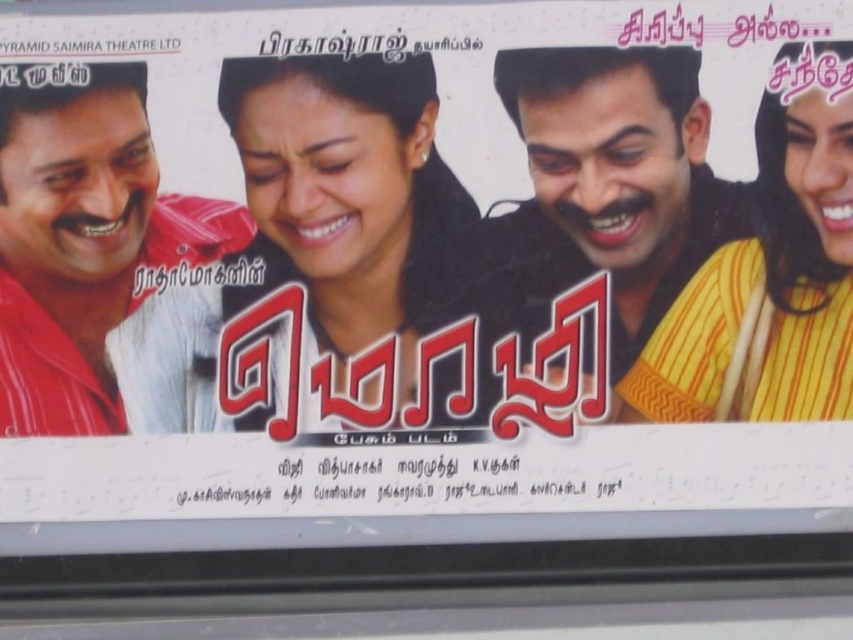
Does matte red shirt at left come behind yellow striped sari at right?

Yes, matte red shirt at left is further from the viewer.

Describe the element at coordinates (83, 237) in the screenshot. The height and width of the screenshot is (640, 853). I see `matte red shirt at left` at that location.

I want to click on matte red shirt at left, so click(x=83, y=237).

Between yellow striped shirt at right and matte red shirt at left, which one appears on the left side from the viewer's perspective?

From the viewer's perspective, matte red shirt at left appears more on the left side.

Does point (641, 124) lie behind point (149, 228)?

No, (641, 124) is in front of (149, 228).

Who is more forward, (x=740, y=193) or (x=45, y=333)?

Point (x=45, y=333) is more forward.

This screenshot has height=640, width=853. In order to click on yellow striped shirt at right in this screenshot , I will do `click(598, 195)`.

Describe the element at coordinates (598, 195) in the screenshot. The width and height of the screenshot is (853, 640). I see `yellow striped shirt at right` at that location.

Locate an element on the screen. The image size is (853, 640). yellow striped shirt at right is located at coordinates (598, 195).

Between point (521, 310) and point (799, 280), which one is positioned in front?

Point (799, 280)

Locate an element on the screen. yellow striped shirt at right is located at coordinates (598, 195).